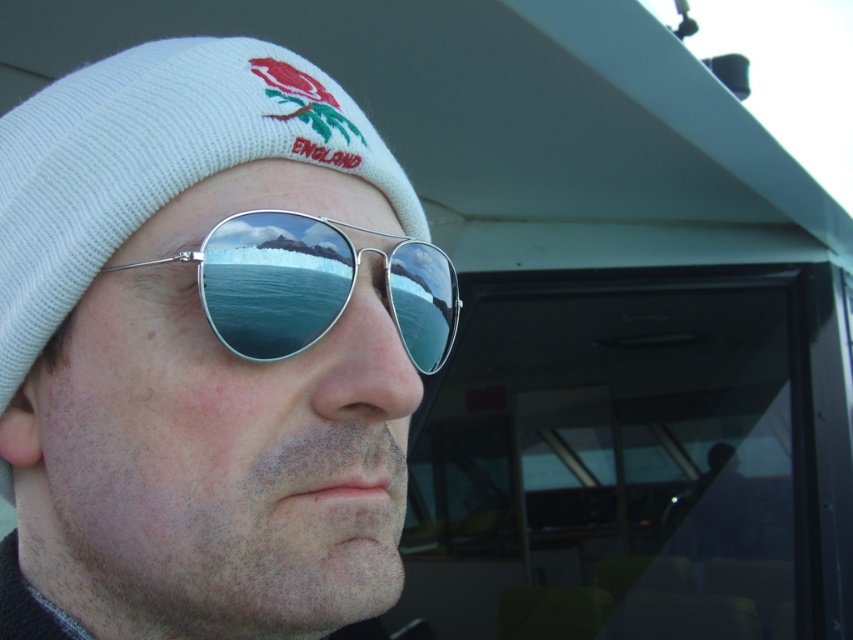
Question: Can you confirm if white knit beanie at upper left is positioned below silver reflective aviator sunglasses at center?

Choices:
 (A) no
 (B) yes

Answer: (B)

Question: Which point is closer to the camera?

Choices:
 (A) (299, 264)
 (B) (136, 180)

Answer: (B)

Question: Can you confirm if white knit beanie at upper left is positioned above silver reflective aviator sunglasses at center?

Choices:
 (A) yes
 (B) no

Answer: (B)

Question: Which of the following is the closest to the observer?

Choices:
 (A) (376, 154)
 (B) (321, 314)

Answer: (B)

Question: Can you confirm if white knit beanie at upper left is positioned to the right of silver reflective aviator sunglasses at center?

Choices:
 (A) yes
 (B) no

Answer: (B)